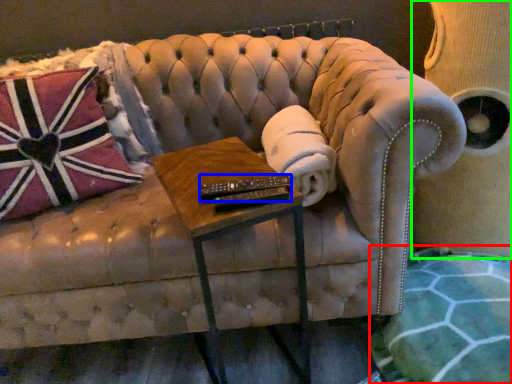
Question: Considering the real-world distances, which object is farthest from blanket (highlighted by a red box)? control (highlighted by a blue box) or swivel chair (highlighted by a green box)?

Choices:
 (A) control
 (B) swivel chair

Answer: (A)